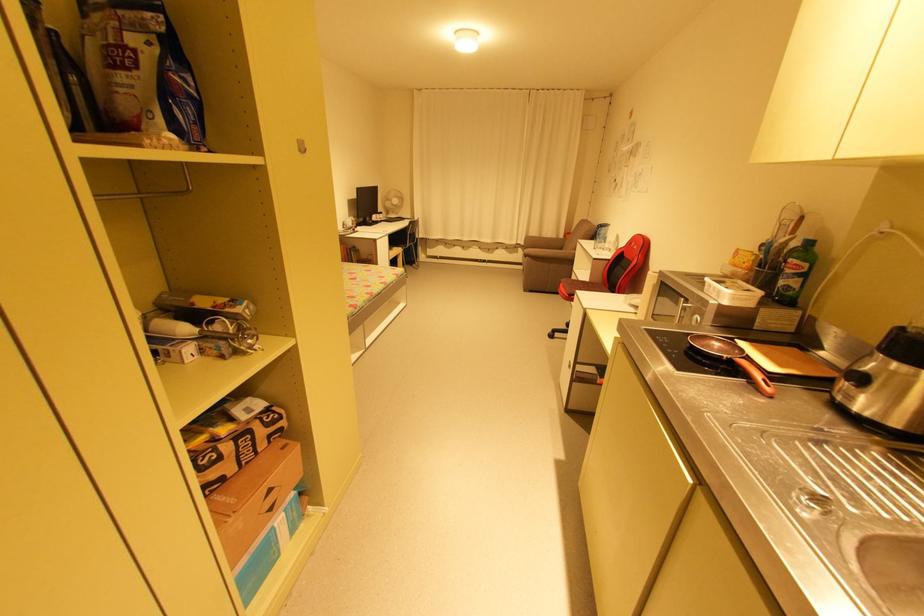
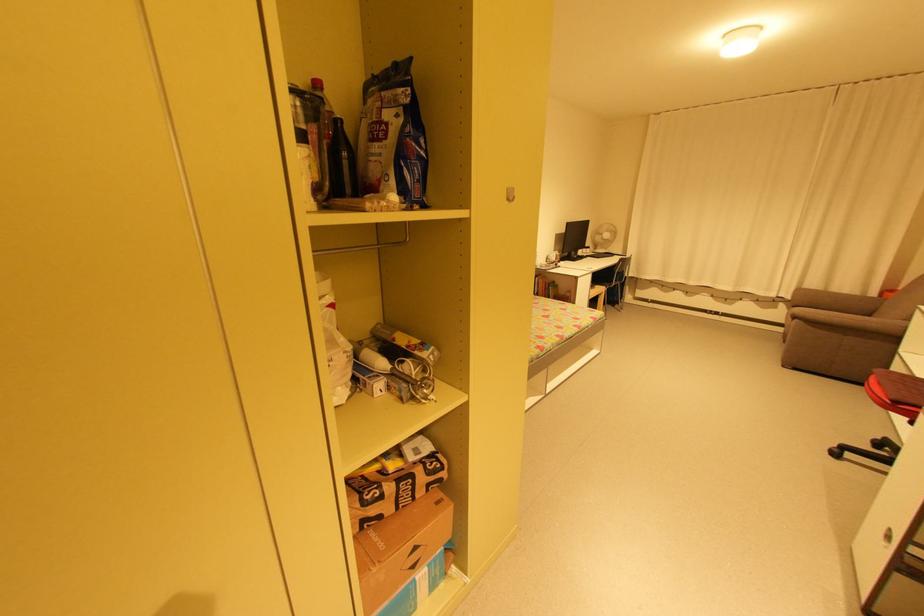
Locate, in the second image, the point that corresponds to pixel 385 215 in the first image.

(592, 249)